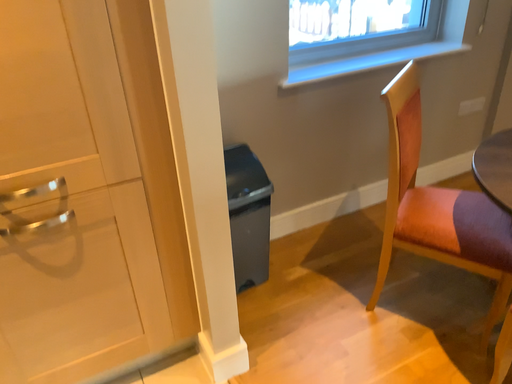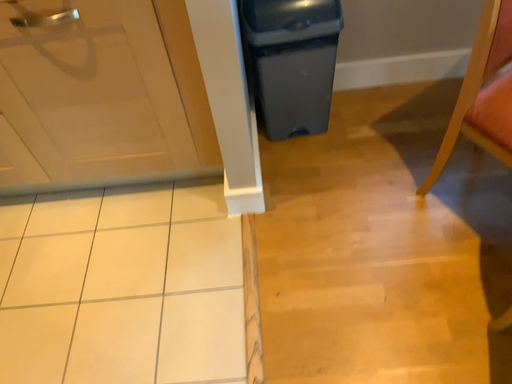
Question: Which way did the camera rotate in the video?

Choices:
 (A) rotated upward
 (B) rotated downward

Answer: (B)